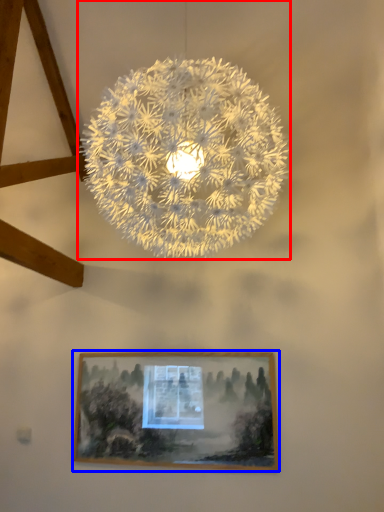
Question: Which object is closer to the camera taking this photo, lamp (highlighted by a red box) or picture frame (highlighted by a blue box)?

Choices:
 (A) lamp
 (B) picture frame

Answer: (A)